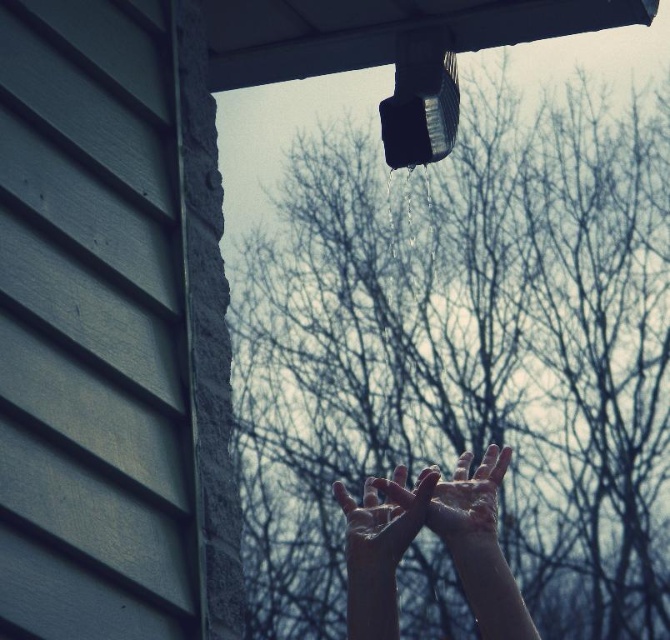
Question: Which point is farther from the camera taking this photo?

Choices:
 (A) (476, 468)
 (B) (399, 554)

Answer: (A)

Question: Is wet skin hands at center positioned behind smooth skin hands at center?

Choices:
 (A) yes
 (B) no

Answer: (A)

Question: Which object appears farthest from the camera in this image?

Choices:
 (A) wet skin hands at center
 (B) smooth skin hands at center
 (C) slightly wet skin at center

Answer: (A)

Question: Which is nearer to the wet skin hands at center?

Choices:
 (A) smooth skin hands at center
 (B) slightly wet skin at center

Answer: (B)

Question: Can you confirm if slightly wet skin at center is positioned above wet skin hands at center?

Choices:
 (A) no
 (B) yes

Answer: (A)

Question: Is wet skin hands at center wider than smooth skin hands at center?

Choices:
 (A) yes
 (B) no

Answer: (A)